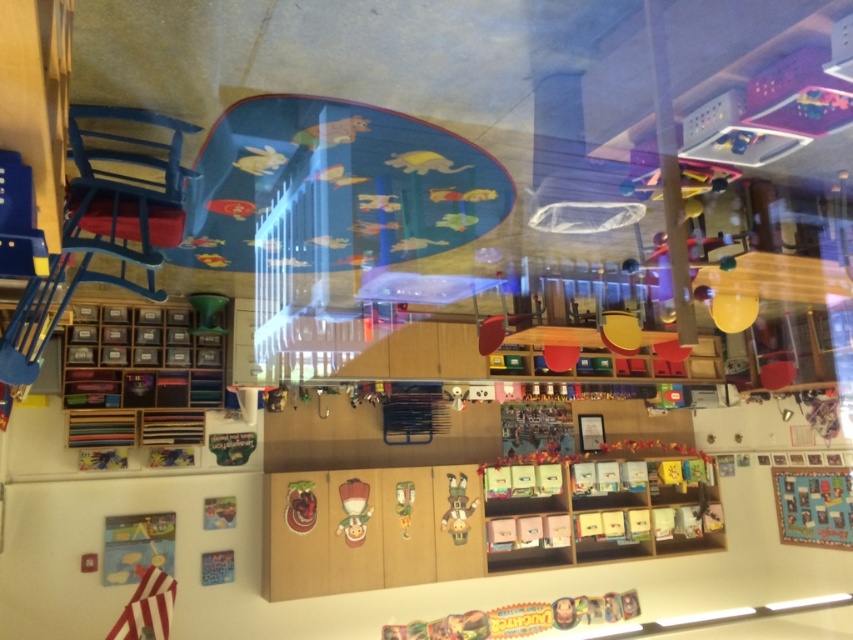
Question: Considering the real-world distances, which object is closest to the matte plastic clown at center?

Choices:
 (A) textured fabric quilt at lower right
 (B) wooden clown at center
 (C) green plastic toy at center

Answer: (C)

Question: Which of the following is the farthest from the observer?

Choices:
 (A) green plastic toy at center
 (B) wooden clown at center
 (C) textured fabric quilt at lower right
 (D) matte plastic clown at center

Answer: (C)

Question: Does matte plastic clown at center come behind wooden clown at center?

Choices:
 (A) no
 (B) yes

Answer: (A)

Question: Is textured fabric quilt at lower right positioned at the back of wooden clown at center?

Choices:
 (A) yes
 (B) no

Answer: (A)

Question: Can you confirm if wooden clown at center is positioned below green plastic toy at center?

Choices:
 (A) no
 (B) yes

Answer: (B)

Question: Which point is farther to the camera?

Choices:
 (A) (457, 499)
 (B) (395, 497)
 (C) (346, 525)

Answer: (A)